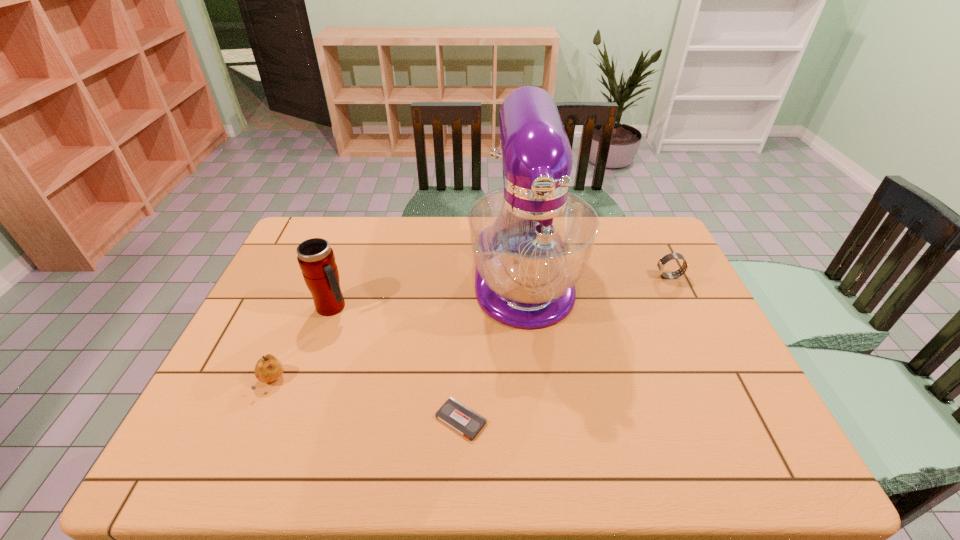
This screenshot has width=960, height=540. In the image, there is a desktop. Find the location of `free region at the near edge`. free region at the near edge is located at coordinates (289, 451).

The width and height of the screenshot is (960, 540). In the image, there is a desktop. What are the coordinates of `free region at the left edge` in the screenshot? It's located at (297, 288).

Locate an element on the screen. Image resolution: width=960 pixels, height=540 pixels. vacant space at the right edge of the desktop is located at coordinates (640, 288).

In the image, there is a desktop. At what (x,y) coordinates should I click in order to perform the action: click on vacant area at the far left corner. Please return your answer as a coordinate pair (x, y). The height and width of the screenshot is (540, 960). Looking at the image, I should click on (310, 234).

Where is `free space that is in between the second nearest object and the fourth shortest object`? The width and height of the screenshot is (960, 540). free space that is in between the second nearest object and the fourth shortest object is located at coordinates (301, 345).

The height and width of the screenshot is (540, 960). I want to click on vacant space in between the tallest object and the rightmost object, so click(596, 276).

Identify the location of vacant space that's between the tallest object and the watch. point(596,276).

Where is `free area in between the rightmost object and the tallest object`? This screenshot has height=540, width=960. free area in between the rightmost object and the tallest object is located at coordinates (596, 276).

Find the location of a particular element. This screenshot has width=960, height=540. free space that is in between the pear and the fourth shortest object is located at coordinates (301, 345).

Identify the location of vacant space in between the fourth object from right to left and the mixer. The height and width of the screenshot is (540, 960). (428, 292).